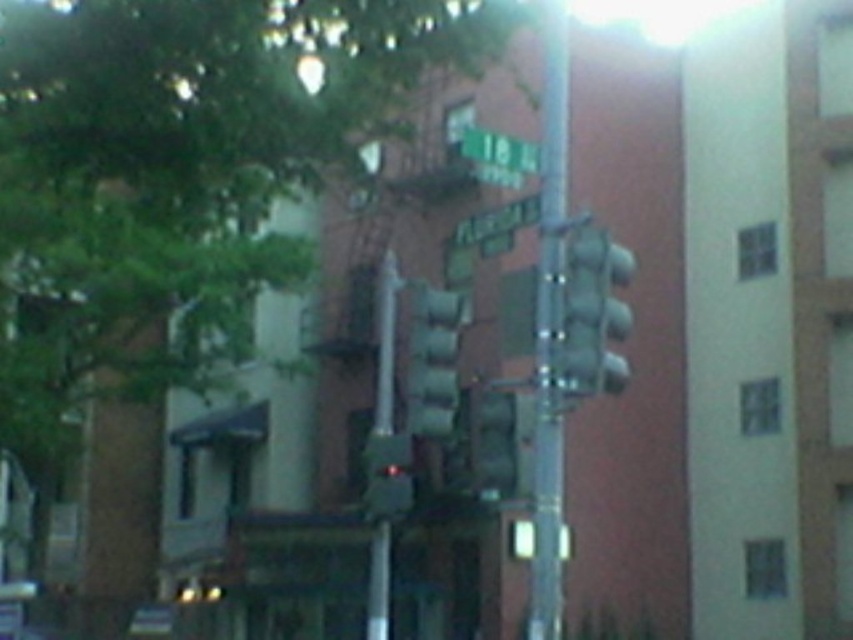
Does point (381, 362) lie in front of point (506, 150)?

That is False.

Between metallic pole at center and green matte street sign at upper center, which one has less height?

green matte street sign at upper center is shorter.

Is point (381, 378) positioned before point (526, 166)?

No, it is behind (526, 166).

You are a GUI agent. You are given a task and a screenshot of the screen. Output one action in this format:
    pyautogui.click(x=<x>, y=<y>)
    Task: Click on the metallic pole at center
    The image size is (853, 640).
    Given the screenshot: What is the action you would take?
    pyautogui.click(x=386, y=346)

Does point (590, 296) lie in front of point (370, 468)?

That is True.

What do you see at coordinates (593, 314) in the screenshot?
I see `metallic gray traffic light at center` at bounding box center [593, 314].

Is point (593, 317) positioned in front of point (384, 396)?

Yes, point (593, 317) is closer to viewer.

The height and width of the screenshot is (640, 853). In order to click on metallic gray traffic light at center in this screenshot , I will do `click(593, 314)`.

Can you confirm if green matte traffic light at center is positioned below green matte street sign at upper center?

Correct, green matte traffic light at center is located below green matte street sign at upper center.

Is green matte traffic light at center positioned at the back of green matte street sign at upper center?

Yes, it is.

Image resolution: width=853 pixels, height=640 pixels. What do you see at coordinates (433, 362) in the screenshot? I see `green matte traffic light at center` at bounding box center [433, 362].

The height and width of the screenshot is (640, 853). In order to click on green matte traffic light at center in this screenshot , I will do `click(433, 362)`.